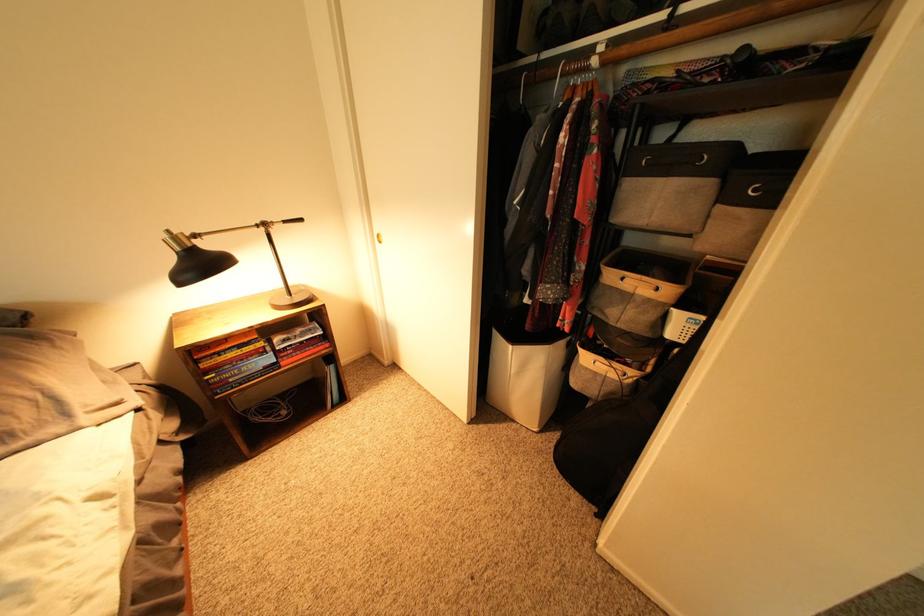
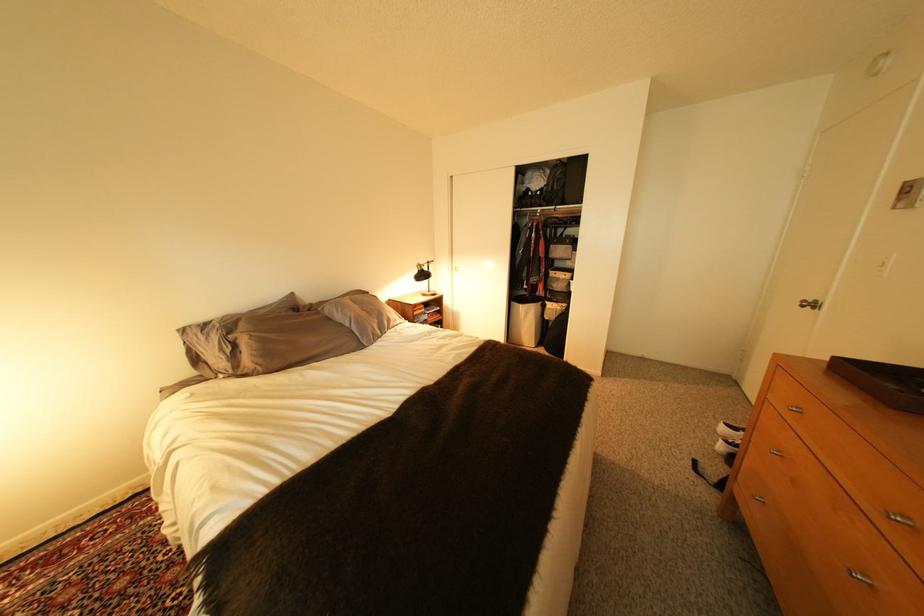
In the second image, find the point that corresponds to (x=523, y=347) in the first image.

(533, 307)